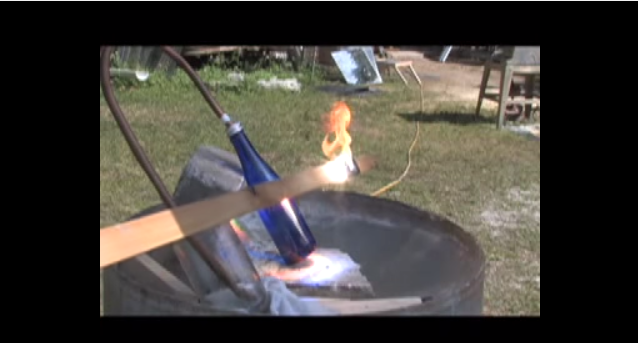
Find the location of a particular element. 1 table on the left is located at coordinates (401, 59).